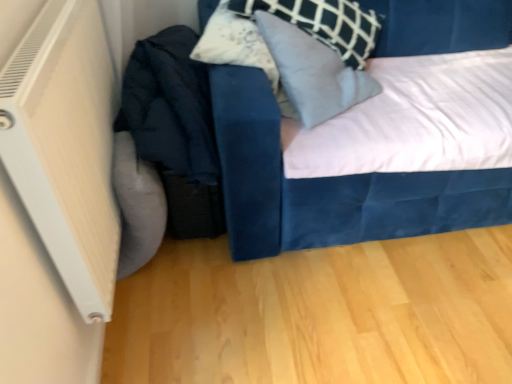
Question: Would you say velvet blue bed at center contains white plastic radiator at left?

Choices:
 (A) yes
 (B) no

Answer: (B)

Question: Is velvet blue bed at center closer to the viewer compared to white plastic radiator at left?

Choices:
 (A) yes
 (B) no

Answer: (B)

Question: Does velvet blue bed at center have a lesser height compared to white plastic radiator at left?

Choices:
 (A) no
 (B) yes

Answer: (A)

Question: Can you confirm if velvet blue bed at center is positioned to the left of white plastic radiator at left?

Choices:
 (A) yes
 (B) no

Answer: (B)

Question: Is velvet blue bed at center touching white plastic radiator at left?

Choices:
 (A) no
 (B) yes

Answer: (A)

Question: Could you tell me if velvet blue bed at center is turned towards white plastic radiator at left?

Choices:
 (A) no
 (B) yes

Answer: (A)

Question: From a real-world perspective, is velvet blue pillow at upper center below velvet blue bed at center?

Choices:
 (A) no
 (B) yes

Answer: (A)

Question: Is velvet blue pillow at upper center behind velvet blue bed at center?

Choices:
 (A) yes
 (B) no

Answer: (A)

Question: Considering the relative sizes of velvet blue pillow at upper center and velvet blue bed at center in the image provided, is velvet blue pillow at upper center smaller than velvet blue bed at center?

Choices:
 (A) no
 (B) yes

Answer: (B)

Question: From a real-world perspective, is velvet blue pillow at upper center on top of velvet blue bed at center?

Choices:
 (A) yes
 (B) no

Answer: (A)

Question: Is velvet blue pillow at upper center not within velvet blue bed at center?

Choices:
 (A) no
 (B) yes

Answer: (A)

Question: Is velvet blue bed at center completely or partially inside velvet blue pillow at upper center?

Choices:
 (A) no
 (B) yes

Answer: (A)

Question: From a real-world perspective, does velvet blue bed at center stand above velvet blue pillow at upper center?

Choices:
 (A) no
 (B) yes

Answer: (A)